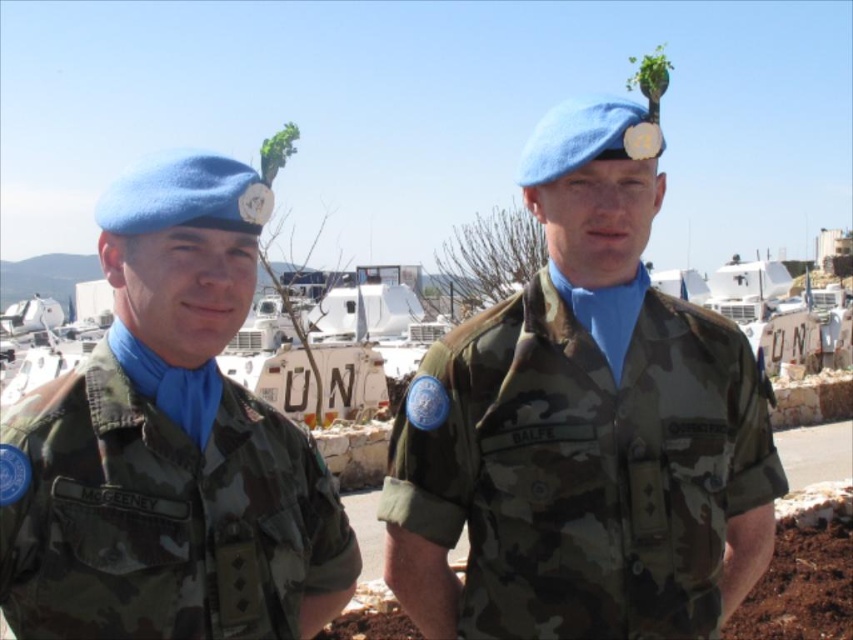
Question: Is camo uniform at center further to camera compared to camo fabric uniform at left?

Choices:
 (A) no
 (B) yes

Answer: (B)

Question: Is camo uniform at center below camo fabric uniform at left?

Choices:
 (A) no
 (B) yes

Answer: (A)

Question: Does camo uniform at center appear under camo fabric uniform at left?

Choices:
 (A) yes
 (B) no

Answer: (B)

Question: Which of the following is the farthest from the observer?

Choices:
 (A) camo uniform at center
 (B) camo fabric uniform at left

Answer: (A)

Question: Which point is farther to the camera?

Choices:
 (A) (215, 541)
 (B) (527, 154)

Answer: (B)